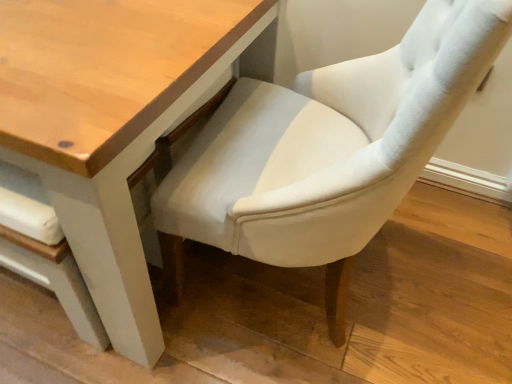
This screenshot has height=384, width=512. In order to click on free spot to the right of light gray fabric chair at center in this screenshot , I will do `click(438, 295)`.